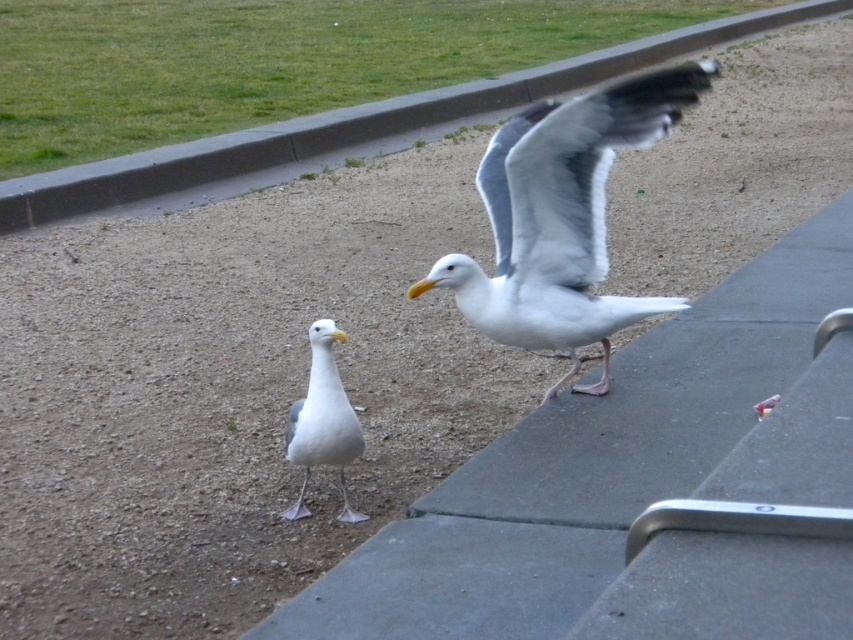
Question: Which point is farther from the camera taking this photo?

Choices:
 (A) (12, 218)
 (B) (357, 518)

Answer: (A)

Question: Can you confirm if white feathered bird at center is bigger than white matte seagull at center?

Choices:
 (A) yes
 (B) no

Answer: (A)

Question: Which point is closer to the camera?

Choices:
 (A) white matte seagull at center
 (B) white feathered bird at center
 (C) gray concrete curb at upper center

Answer: (B)

Question: Can you confirm if white feathered bird at center is wider than gray concrete curb at upper center?

Choices:
 (A) yes
 (B) no

Answer: (B)

Question: In this image, where is white feathered bird at center located relative to white matte seagull at center?

Choices:
 (A) left
 (B) right

Answer: (B)

Question: Which object is closer to the camera taking this photo?

Choices:
 (A) white feathered bird at center
 (B) white matte seagull at center
 (C) gray concrete curb at upper center

Answer: (A)